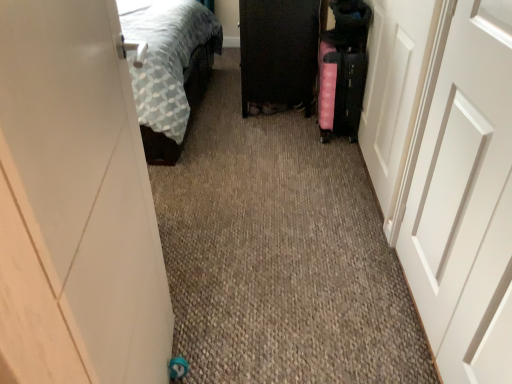
Question: In the image, is white glossy door at right, which is the third door from left to right, positioned in front of or behind white matte door at right, placed as the 2th door when sorted from left to right?

Choices:
 (A) front
 (B) behind

Answer: (B)

Question: Considering the positions of white glossy door at right, which appears as the 1th door when viewed from the right, and white matte door at right, placed as the 2th door when sorted from left to right, in the image, is white glossy door at right, which appears as the 1th door when viewed from the right, wider or thinner than white matte door at right, placed as the 2th door when sorted from left to right,?

Choices:
 (A) thin
 (B) wide

Answer: (B)

Question: Which object is positioned farthest from the white glossy door at right, which appears as the 1th door when viewed from the right?

Choices:
 (A) white glossy door at left, acting as the third door starting from the right
 (B) pink fabric suitcase at right
 (C) white matte door at right, arranged as the 2th door when viewed from the right
 (D) black glossy cabinet at center

Answer: (A)

Question: Based on their relative distances, which object is nearer to the white glossy door at left, which is the first door in left-to-right order?

Choices:
 (A) white matte door at right, arranged as the 2th door when viewed from the right
 (B) black glossy cabinet at center
 (C) white glossy door at right, which is the third door from left to right
 (D) pink fabric suitcase at right

Answer: (A)